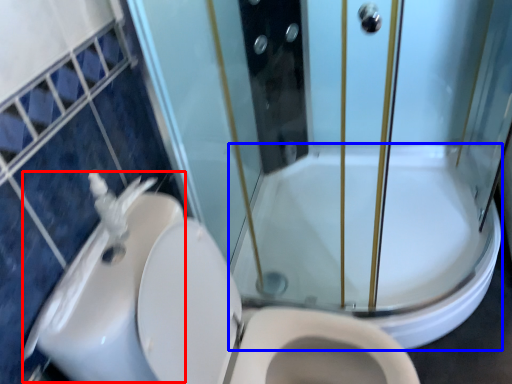
Question: Which point is further to the camera, sink (highlighted by a red box) or bath (highlighted by a blue box)?

Choices:
 (A) sink
 (B) bath

Answer: (B)